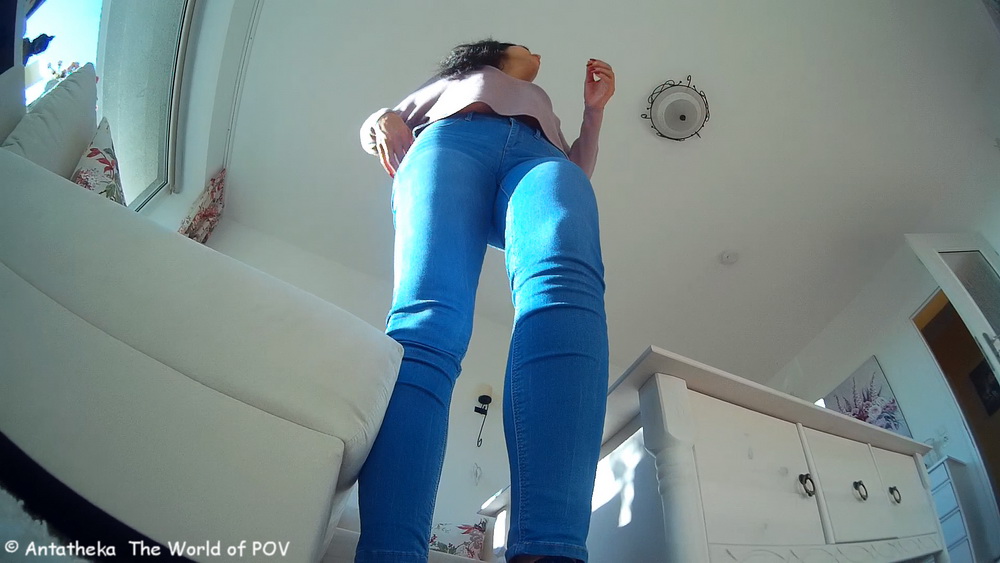
At what (x,y) coordinates should I click in order to perform the action: click on couch. Please return your answer as a coordinate pair (x, y). The width and height of the screenshot is (1000, 563). Looking at the image, I should click on (150, 298).